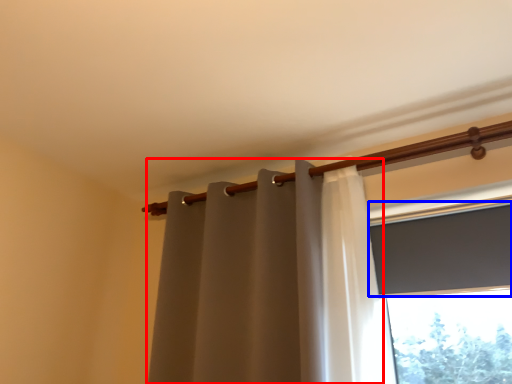
Question: Among these objects, which one is farthest to the camera, curtain (highlighted by a red box) or window screen (highlighted by a blue box)?

Choices:
 (A) curtain
 (B) window screen

Answer: (B)